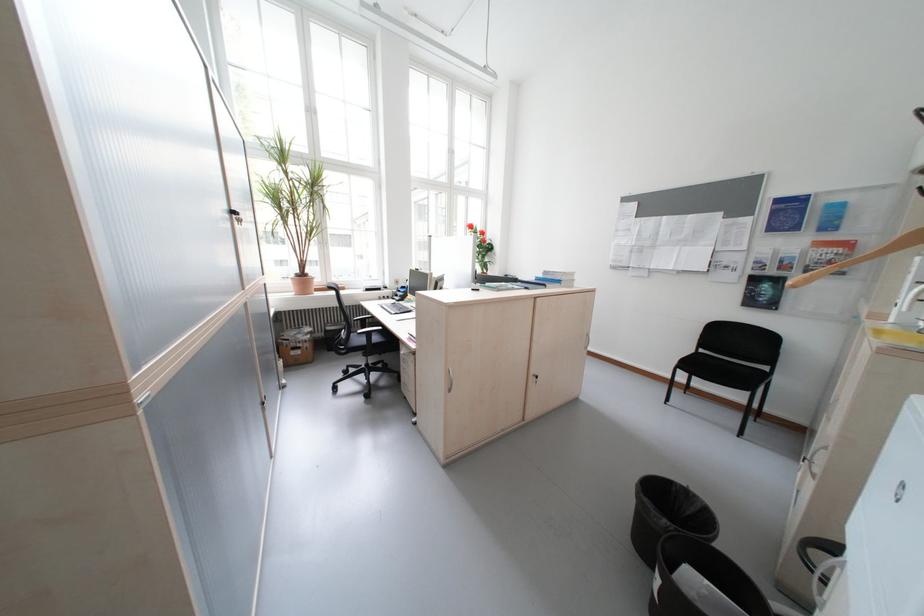
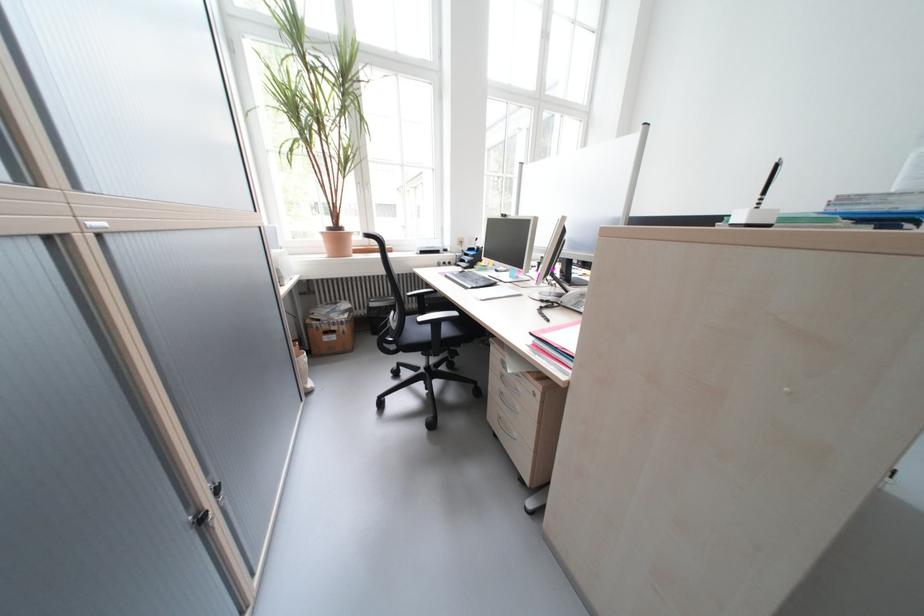
The point at (x=370, y=333) is marked in the first image. Where is the corresponding point in the second image?

(431, 320)